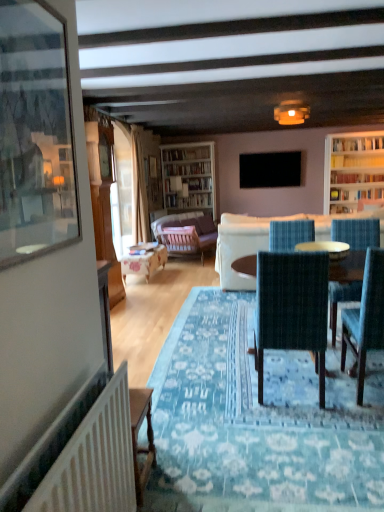
What do you see at coordinates (35, 134) in the screenshot? This screenshot has width=384, height=512. I see `clear glass picture frame at left` at bounding box center [35, 134].

What do you see at coordinates (263, 241) in the screenshot?
I see `white fabric couch at center, acting as the 1th studio couch starting from the front` at bounding box center [263, 241].

What is the approximate width of white fabric couch at center, the 2th studio couch when ordered from back to front?

white fabric couch at center, the 2th studio couch when ordered from back to front, is 1.26 meters in width.

You are a GUI agent. You are given a task and a screenshot of the screen. Output one action in this format:
    pyautogui.click(x=<x>, y=<y>)
    Task: Click on the matte yellow lampshade at upper center
    
    Given the screenshot: What is the action you would take?
    pyautogui.click(x=291, y=112)

Measure the distance between velvet blue armchair at center and camera.

velvet blue armchair at center is 5.76 meters from camera.

How much space does dark green fabric chair at center, placed as the second chair when sorted from right to left, occupy horizontally?

The width of dark green fabric chair at center, placed as the second chair when sorted from right to left, is 22.24 inches.

What do you see at coordinates (137, 437) in the screenshot?
I see `wooden desk at lower left` at bounding box center [137, 437].

What is the approximate height of white textured radiator at lower left?

25.57 inches.

The height and width of the screenshot is (512, 384). What do you see at coordinates (94, 460) in the screenshot?
I see `white textured radiator at lower left` at bounding box center [94, 460].

This screenshot has width=384, height=512. Find the location of `beige fabric curtain at left`. beige fabric curtain at left is located at coordinates (139, 191).

Locate an element on the screen. clear glass picture frame at left is located at coordinates (35, 134).

From the image's perspective, is wooden cabinet at left over wooden desk at lower left?

Yes, from the image's perspective, wooden cabinet at left is on top of wooden desk at lower left.

From a real-world perspective, is wooden cabinet at left on top of wooden desk at lower left?

Indeed, from a real-world perspective, wooden cabinet at left stands above wooden desk at lower left.

Does wooden cabinet at left have a greater width compared to wooden desk at lower left?

Indeed, wooden cabinet at left has a greater width compared to wooden desk at lower left.

Is black matte television at upper center beside wooden bookcase at center?

No.

Who is bigger, black matte television at upper center or wooden bookcase at center?

With larger size is wooden bookcase at center.

Can you confirm if black matte television at upper center is positioned to the left of wooden bookcase at center?

Incorrect, black matte television at upper center is not on the left side of wooden bookcase at center.

Does black matte television at upper center come in front of wooden bookcase at center?

Yes, the depth of black matte television at upper center is less than that of wooden bookcase at center.

From the picture: From a real-world perspective, does velvet blue armchair at center sit lower than dark green fabric chair at center, the 1th chair positioned from the left?

No.

Between velvet blue armchair at center and dark green fabric chair at center, the 1th chair positioned from the left, which one appears on the left side from the viewer's perspective?

Positioned to the left is dark green fabric chair at center, the 1th chair positioned from the left.

Looking at the image, does velvet blue armchair at center seem bigger or smaller compared to dark green fabric chair at center, placed as the second chair when sorted from right to left?

Clearly, velvet blue armchair at center is smaller in size than dark green fabric chair at center, placed as the second chair when sorted from right to left.

Is velvet blue armchair at center looking in the opposite direction of dark green fabric chair at center, placed as the second chair when sorted from right to left?

No, dark green fabric chair at center, placed as the second chair when sorted from right to left, is not at the back of velvet blue armchair at center.

Looking at this image, are white fabric couch at center, the 2th studio couch when ordered from back to front, and black matte television at upper center making contact?

white fabric couch at center, the 2th studio couch when ordered from back to front, is not next to black matte television at upper center, and they're not touching.

You are a GUI agent. You are given a task and a screenshot of the screen. Output one action in this format:
    pyautogui.click(x=<x>, y=<y>)
    Task: Click on the television lying on the right of white fabric couch at center, the 2th studio couch when ordered from back to front
    
    Given the screenshot: What is the action you would take?
    (x=270, y=169)

In the scene shown: Considering the relative sizes of white fabric couch at center, the 2th studio couch when ordered from back to front, and black matte television at upper center in the image provided, is white fabric couch at center, the 2th studio couch when ordered from back to front, taller than black matte television at upper center?

Yes.

From a real-world perspective, relative to black matte television at upper center, is white fabric couch at center, acting as the 1th studio couch starting from the front, vertically above or below?

Clearly, from a real-world perspective, white fabric couch at center, acting as the 1th studio couch starting from the front, is below black matte television at upper center.

From the image's perspective, which object appears higher, beige fabric curtain at left or wooden cabinet at left?

beige fabric curtain at left, from the image's perspective.

Locate an element on the screen. The height and width of the screenshot is (512, 384). cabinetry directly beneath the beige fabric curtain at left (from a real-world perspective) is located at coordinates (103, 201).

Is beige fabric curtain at left positioned beyond the bounds of wooden cabinet at left?

Yes.

Is beige fabric curtain at left facing away from wooden cabinet at left?

beige fabric curtain at left is not turned away from wooden cabinet at left.

How different are the orientations of wooden desk at lower left and wooden cabinet at left in degrees?

They differ by 92.1 degrees in their facing directions.

From a real-world perspective, is wooden desk at lower left physically located above or below wooden cabinet at left?

In terms of real-world spatial position, wooden desk at lower left is below wooden cabinet at left.

Can you confirm if wooden desk at lower left is positioned to the right of wooden cabinet at left?

Indeed, wooden desk at lower left is positioned on the right side of wooden cabinet at left.

Is dark green fabric chair at center, placed as the second chair when sorted from right to left, bigger or smaller than velvet blue chair at center, the 1th chair from the right?

Clearly, dark green fabric chair at center, placed as the second chair when sorted from right to left, is larger in size than velvet blue chair at center, the 1th chair from the right.

From a real-world perspective, is dark green fabric chair at center, placed as the second chair when sorted from right to left, on velvet blue chair at center, the 1th chair from the right?

Yes, from a real-world perspective, dark green fabric chair at center, placed as the second chair when sorted from right to left, is on top of velvet blue chair at center, the 1th chair from the right.

Considering the positions of objects dark green fabric chair at center, placed as the second chair when sorted from right to left, and velvet blue chair at center, the 1th chair from the right, in the image provided, who is more to the left, dark green fabric chair at center, placed as the second chair when sorted from right to left, or velvet blue chair at center, the 1th chair from the right,?

dark green fabric chair at center, placed as the second chair when sorted from right to left, is more to the left.

What's the angular difference between dark green fabric chair at center, the 1th chair positioned from the left, and velvet blue chair at center, placed as the 2th chair when sorted from left to right,'s facing directions?

They differ by 1.4 degrees in their facing directions.

Find the location of a particular element. This screenshot has width=384, height=512. cabinetry behind the wooden desk at lower left is located at coordinates (103, 201).

Find the location of a particular element. bookcase lying below the black matte television at upper center (from the image's perspective) is located at coordinates (189, 176).

Looking at the image, which one is located closer to velvet purple couch at center, the second studio couch positioned from the front, wooden round table at center or wooden table at center?

wooden table at center lies closer to velvet purple couch at center, the second studio couch positioned from the front, than the other object.

Which object lies further to the anchor point dark green fabric chair at center, the 1th chair positioned from the left, black matte television at upper center or velvet purple couch at center, the second studio couch positioned from the front?

velvet purple couch at center, the second studio couch positioned from the front.

Estimate the real-world distances between objects in this image. Which object is closer to velvet blue armchair at center, wooden cabinet at left or velvet purple couch at center, arranged as the 1th studio couch when viewed from the back?

velvet purple couch at center, arranged as the 1th studio couch when viewed from the back, is positioned closer to the anchor velvet blue armchair at center.

From the image, which object appears to be farther from velvet blue armchair at center, velvet blue chair at center, the 1th chair from the right, or wooden cabinet at left?

The object further to velvet blue armchair at center is wooden cabinet at left.

Consider the image. Based on their spatial positions, is white textured radiator at lower left or wooden cabinet at left closer to beige fabric curtain at left?

wooden cabinet at left.

From the image, which object appears to be nearer to clear glass picture frame at left, dark green fabric chair at center, placed as the second chair when sorted from right to left, or white fabric couch at center, the 2th studio couch when ordered from back to front?

dark green fabric chair at center, placed as the second chair when sorted from right to left, is positioned closer to the anchor clear glass picture frame at left.

From the image, which object appears to be farther from wooden table at center, wooden cabinet at left or dark green fabric chair at center, the 1th chair positioned from the left?

dark green fabric chair at center, the 1th chair positioned from the left, is positioned further to the anchor wooden table at center.

Looking at the image, which one is located closer to velvet purple couch at center, the second studio couch positioned from the front, wooden table at center or black matte television at upper center?

wooden table at center is positioned closer to the anchor velvet purple couch at center, the second studio couch positioned from the front.

You are a GUI agent. You are given a task and a screenshot of the screen. Output one action in this format:
    pyautogui.click(x=<x>, y=<y>)
    Task: Click on the curtain between clear glass picture frame at left and wooden bookcase at center in the front-back direction
    The width and height of the screenshot is (384, 512).
    Given the screenshot: What is the action you would take?
    pyautogui.click(x=139, y=191)

Locate an element on the screen. studio couch between velvet blue chair at center, placed as the 2th chair when sorted from left to right, and matte yellow lampshade at upper center from front to back is located at coordinates (263, 241).

Image resolution: width=384 pixels, height=512 pixels. I want to click on studio couch between wooden round table at center and matte yellow lampshade at upper center along the z-axis, so click(263, 241).

Locate an element on the screen. lamp between dark green fabric chair at center, placed as the second chair when sorted from right to left, and beige fabric curtain at left in the front-back direction is located at coordinates 291,112.